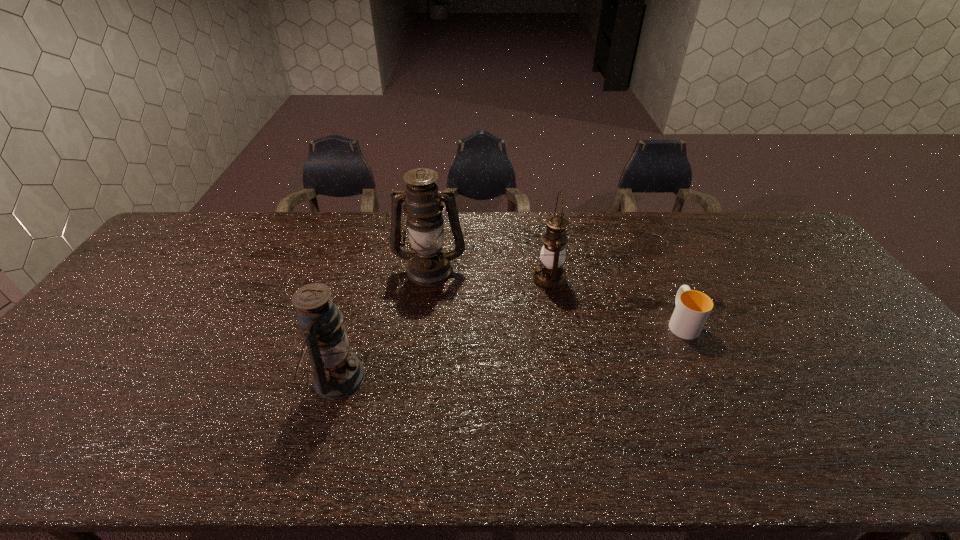
Where is `the second oil lamp from left to right`? the second oil lamp from left to right is located at coordinates (429, 264).

Where is `the second object from right to left`? the second object from right to left is located at coordinates (550, 275).

At what (x,y) coordinates should I click in order to perform the action: click on the leftmost object. Please return your answer as a coordinate pair (x, y). The height and width of the screenshot is (540, 960). Looking at the image, I should click on (337, 372).

Where is `the nearest oil lamp`? The height and width of the screenshot is (540, 960). the nearest oil lamp is located at coordinates (337, 372).

Where is `cup`? cup is located at coordinates (693, 307).

This screenshot has width=960, height=540. Identify the location of the second nearest object. (693, 307).

Where is `free spot located on the front of the second oil lamp from right to left`? Image resolution: width=960 pixels, height=540 pixels. free spot located on the front of the second oil lamp from right to left is located at coordinates (420, 346).

The height and width of the screenshot is (540, 960). I want to click on blank space located 0.060m on the back of the rightmost oil lamp, so click(545, 254).

Where is `vacant space situated 0.370m on the back of the nearest object`? The height and width of the screenshot is (540, 960). vacant space situated 0.370m on the back of the nearest object is located at coordinates (371, 258).

Locate an element on the screen. Image resolution: width=960 pixels, height=540 pixels. free space located with the handle on the side of the cup is located at coordinates (659, 272).